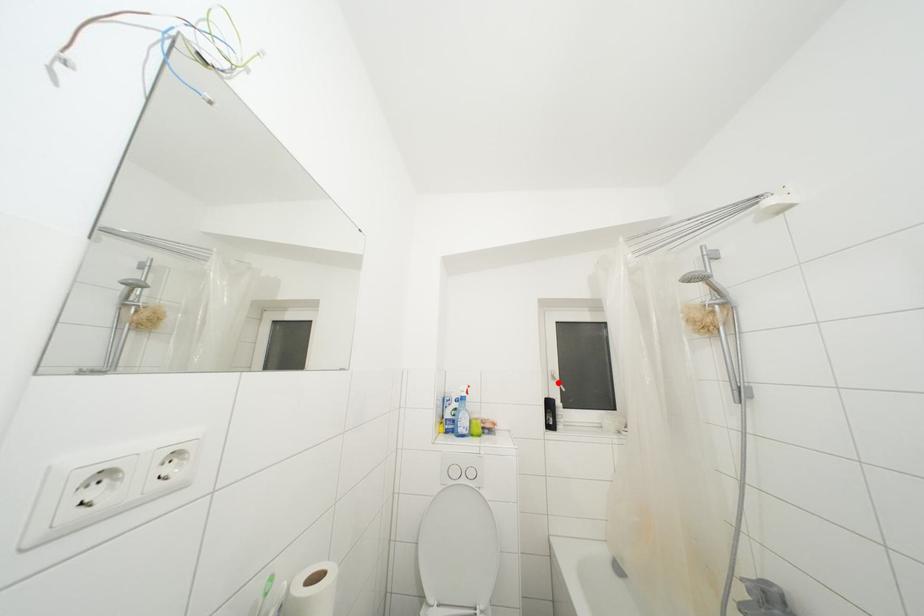
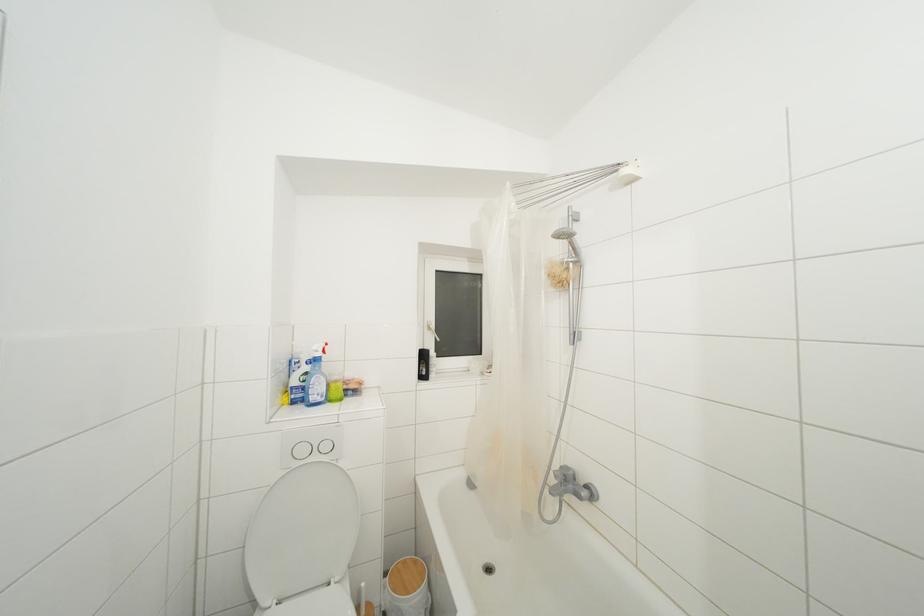
Question: I am providing you with two images of the same scene from different viewpoints. A red point is marked on the first image. Can you still see the location of the red point in image 2?

Choices:
 (A) Yes
 (B) No

Answer: (A)